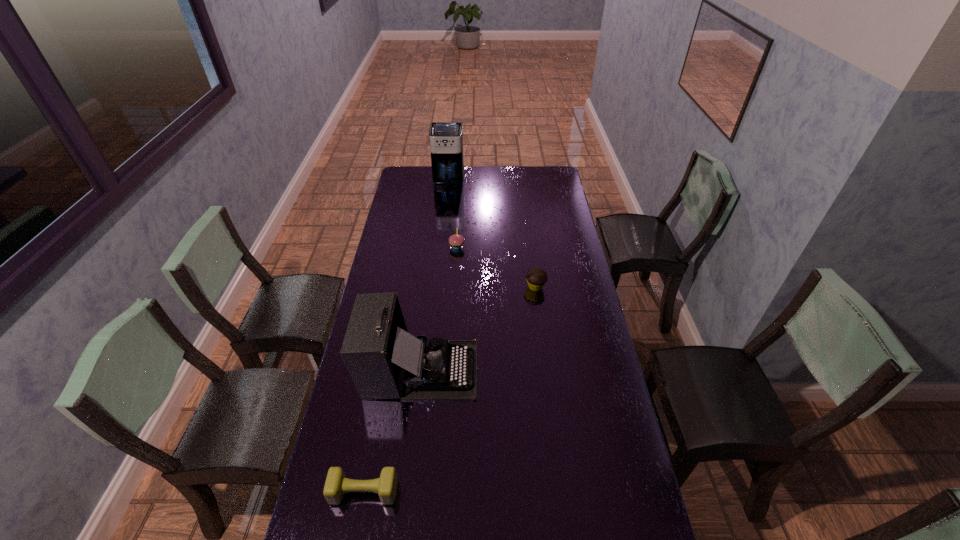
The image size is (960, 540). What are the coordinates of `free space that satisfies the following two spatial constraints: 1. on the front panel of the third tallest object; 2. on the right side of the coffee maker` in the screenshot? It's located at (442, 247).

The width and height of the screenshot is (960, 540). Identify the location of vacant position in the image that satisfies the following two spatial constraints: 1. on the front panel of the rightmost object; 2. on the right side of the coffee maker. [x=438, y=287].